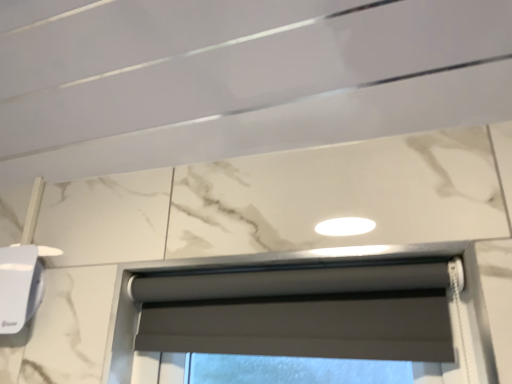
What do you see at coordinates (302, 307) in the screenshot? The height and width of the screenshot is (384, 512). I see `matte gray roller blind at center` at bounding box center [302, 307].

Find the location of `matte gray roller blind at center`. matte gray roller blind at center is located at coordinates (302, 307).

Locate an element on the screen. matte gray roller blind at center is located at coordinates (302, 307).